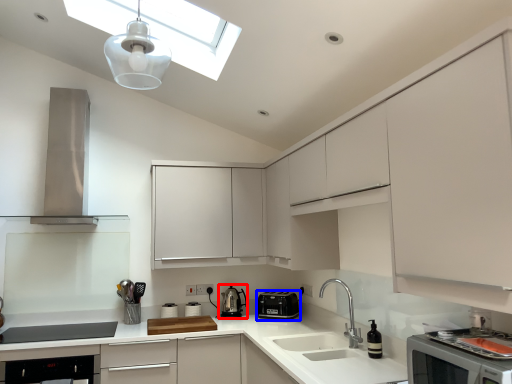
Question: Which object appears closest to the camera in this image, kitchen appliance (highlighted by a red box) or kitchen appliance (highlighted by a blue box)?

Choices:
 (A) kitchen appliance
 (B) kitchen appliance

Answer: (B)